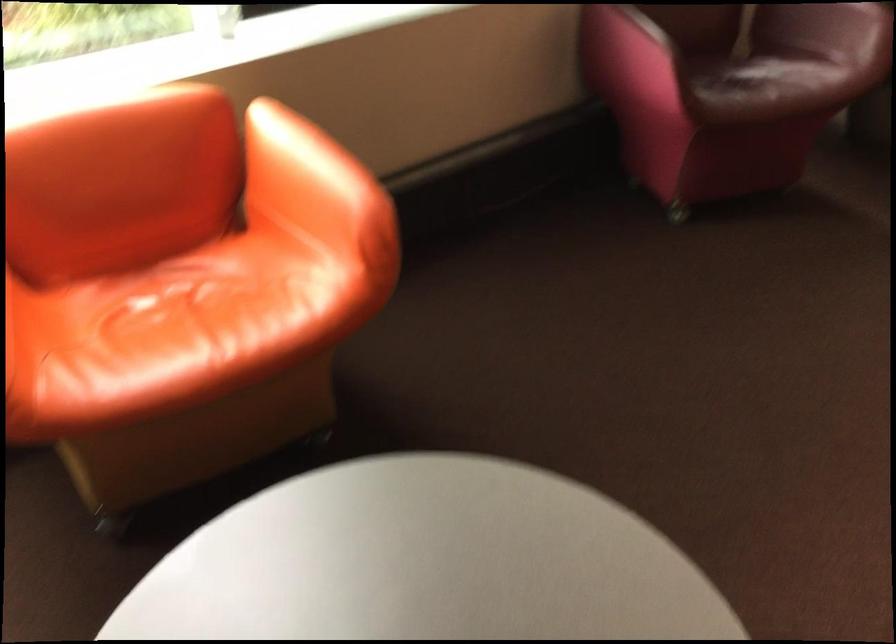
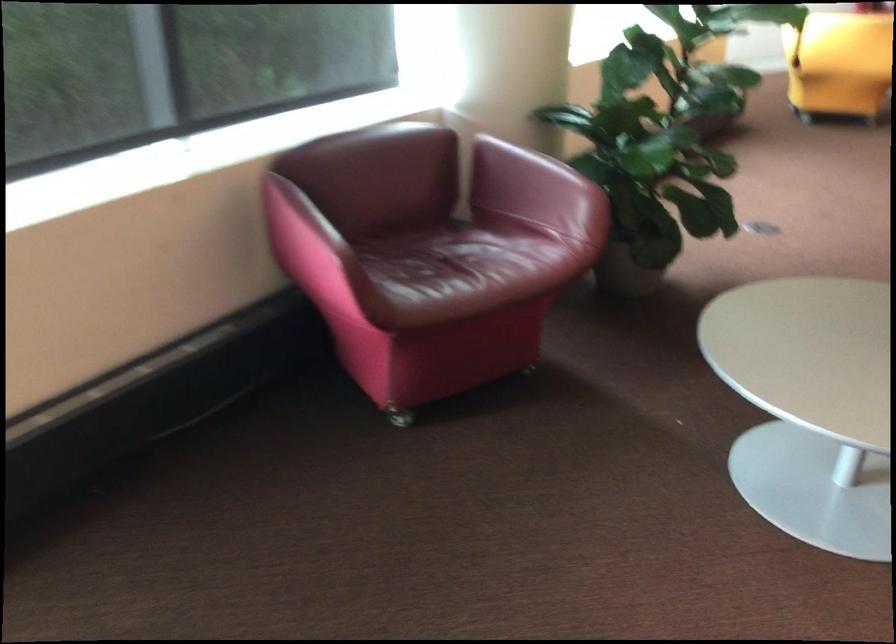
In the second image, find the point that corresponds to the point at 761,76 in the first image.

(466, 266)